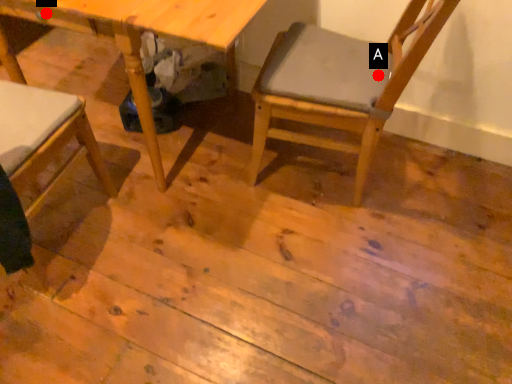
Question: Two points are circled on the image, labeled by A and B beside each circle. Which of the following is the farthest from the observer?

Choices:
 (A) A is further
 (B) B is further

Answer: (A)